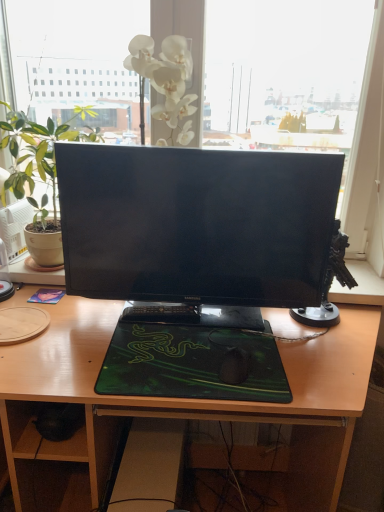
This screenshot has width=384, height=512. In order to click on vacant area to the right of black matte mouse at center in this screenshot , I will do `click(301, 366)`.